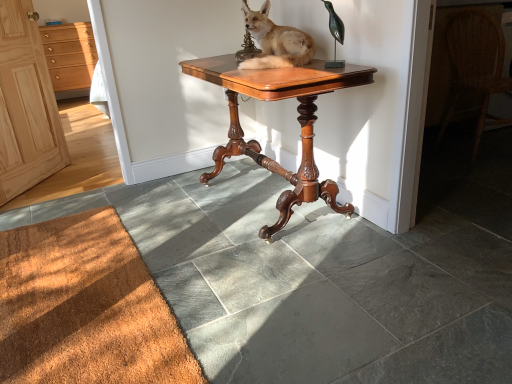
Identify the location of vacant area on top of brown textured mat at lower left (from a real-world perspective). The width and height of the screenshot is (512, 384). (77, 282).